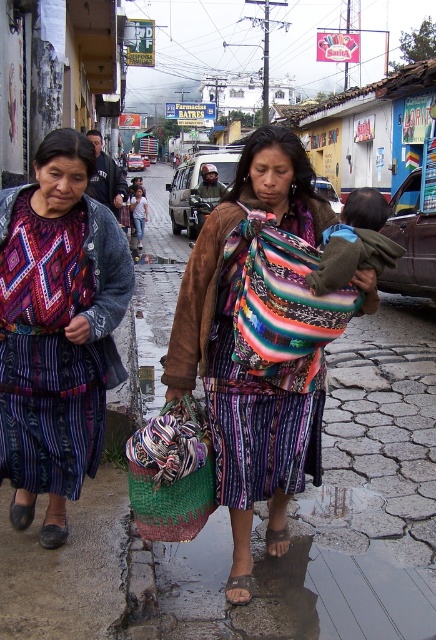
You are a delivery person trying to navigate through the street. You see a matte black jacket at left and a braided straw bag at lower center. Which object is closer to the left side of the street?

The matte black jacket at left is closer to the left side of the street as it is positioned to the left of the braided straw bag at lower center.

You are a delivery person carrying a package that requires a large, flat surface to place it temporarily. You see a multicolored woven shawl at center and a matte black jacket at left. Which item would provide a more suitable surface for placing your package?

The multicolored woven shawl at center is larger in size than the matte black jacket at left, so it would provide a more suitable surface for placing the package.

You are a delivery person who needs to place a package on the ground near the matte black jacket at left. Based on the scene description, where should you place the package to avoid the puddles?

The puddles are scattered across the street, so placing the package near the matte black jacket at left at point (57, 330) would avoid the puddles.